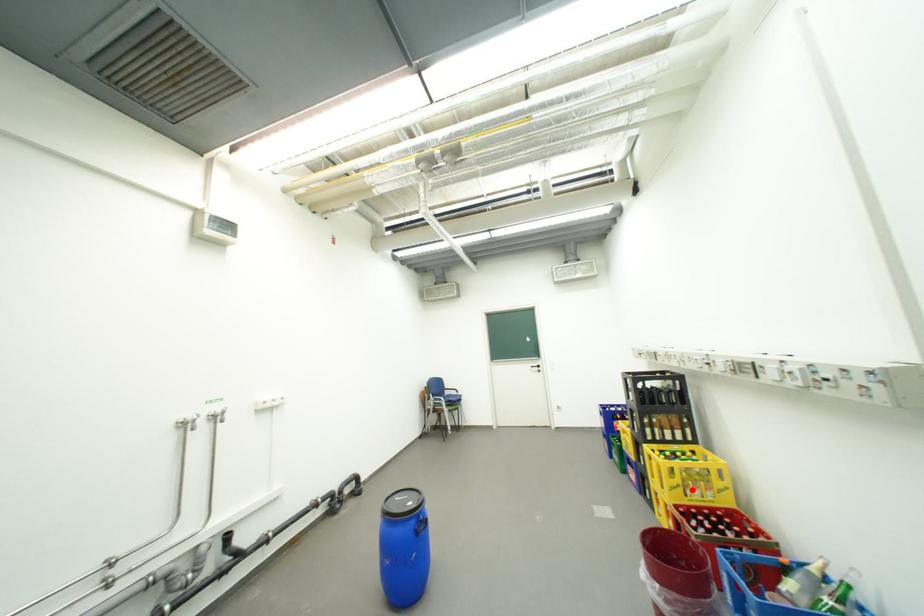
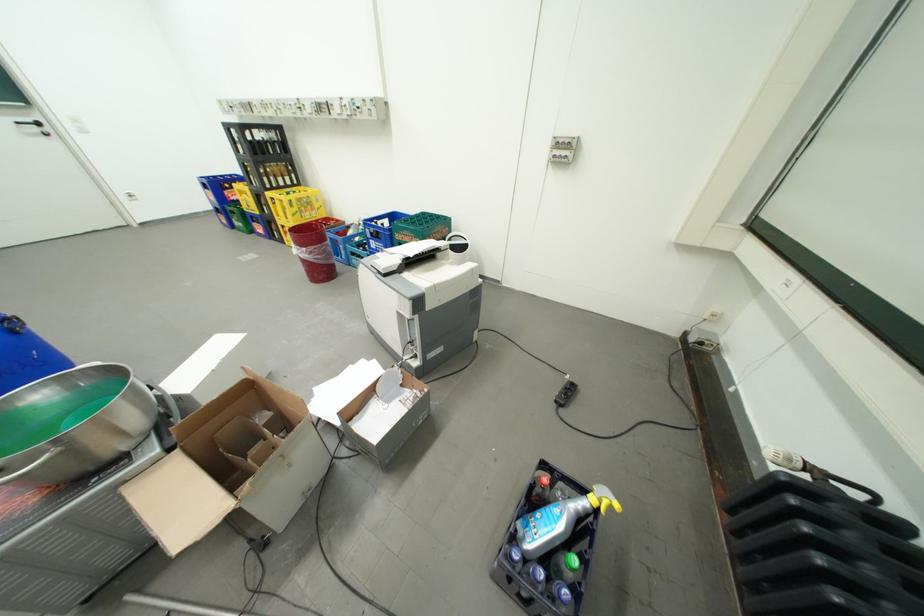
Locate, in the second image, the point that corresponds to the highlighted location in the first image.

(310, 215)